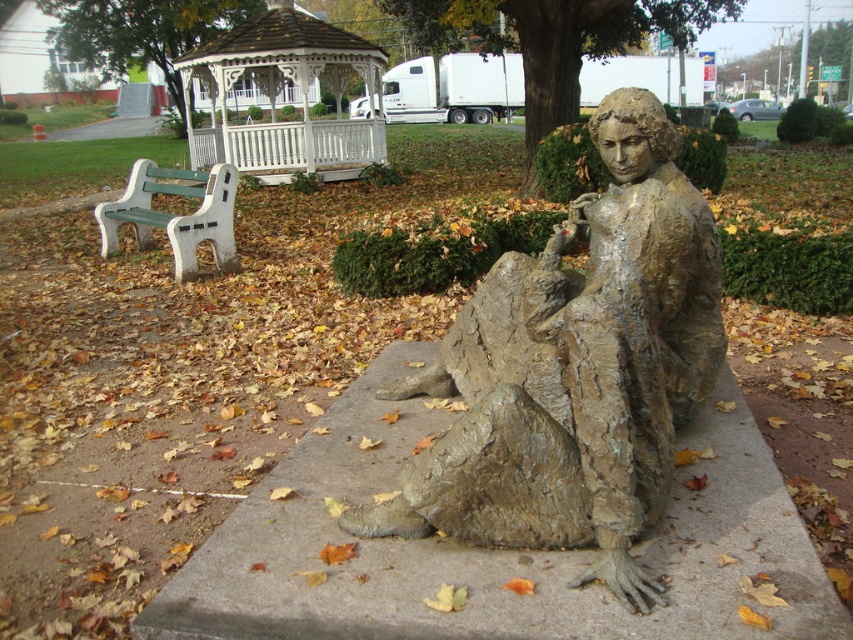
Looking at this image, you are standing in the park and want to take a photo of the rough concrete statue at center and the white wood gazebo at upper center. Which object should you focus on first to ensure both are in the frame?

You should focus on the rough concrete statue at center first since it is closer to you than the white wood gazebo at upper center, ensuring both are in the frame.

You are planning to install a new lighting system for the bronze textured statue at center and the white wood gazebo at upper center. The minimum distance required between the two fixtures is 10 meters. Based on the scene description, will the current spacing between them meet the requirement?

The bronze textured statue at center and the white wood gazebo at upper center are 10.94 meters apart, which exceeds the minimum required distance of 10 meters. Therefore, the current spacing meets the requirement.